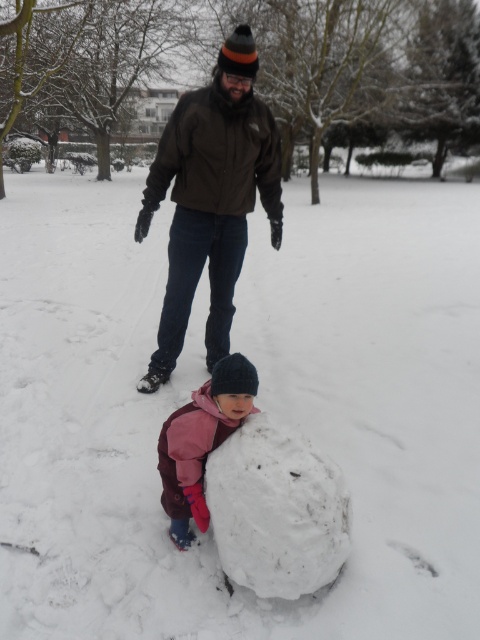
Question: Is dark brown jacket at center in front of pink fleece jacket at center?

Choices:
 (A) yes
 (B) no

Answer: (B)

Question: Based on their relative distances, which object is farther from the white fluffy snowball at lower center?

Choices:
 (A) dark brown jacket at center
 (B) dark brown softshell jacket at center

Answer: (B)

Question: Among these objects, which one is nearest to the camera?

Choices:
 (A) dark brown softshell jacket at center
 (B) dark brown jacket at center
 (C) white fluffy snowball at lower center

Answer: (C)

Question: In this image, where is dark brown jacket at center located relative to white fluffy snowball at lower center?

Choices:
 (A) right
 (B) left

Answer: (B)

Question: Which point is farther to the camera?

Choices:
 (A) (196, 134)
 (B) (200, 497)
 (C) (336, 481)

Answer: (A)

Question: Can you confirm if dark brown jacket at center is bigger than pink fleece jacket at center?

Choices:
 (A) no
 (B) yes

Answer: (B)